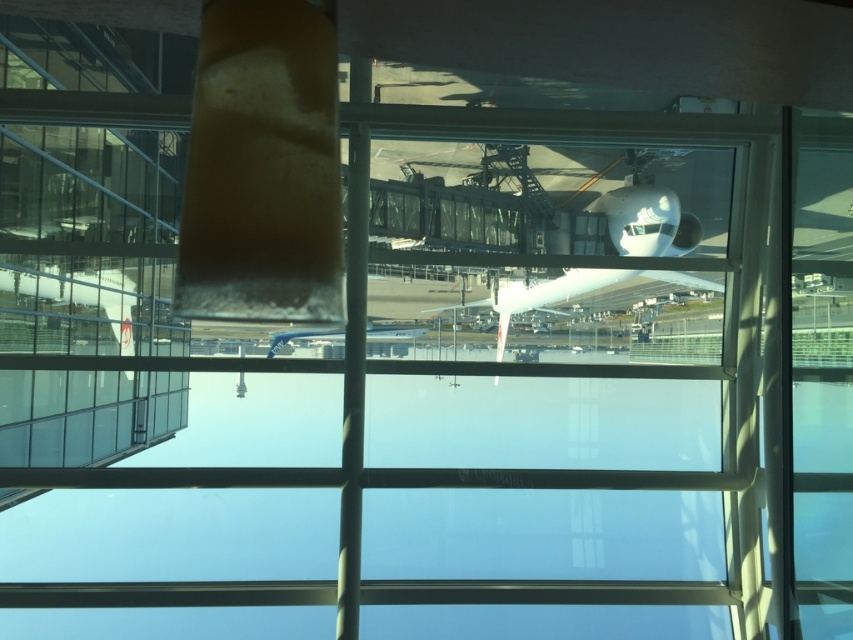
Question: From the image, what is the correct spatial relationship of white glossy airplane at center in relation to blue metallic airplane at center?

Choices:
 (A) below
 (B) above

Answer: (B)

Question: Is white glossy airplane at center further to the viewer compared to blue metallic airplane at center?

Choices:
 (A) no
 (B) yes

Answer: (B)

Question: Is white glossy airplane at center thinner than blue metallic airplane at center?

Choices:
 (A) no
 (B) yes

Answer: (A)

Question: Which object appears closest to the camera in this image?

Choices:
 (A) blue metallic airplane at center
 (B) white glossy airplane at center

Answer: (A)